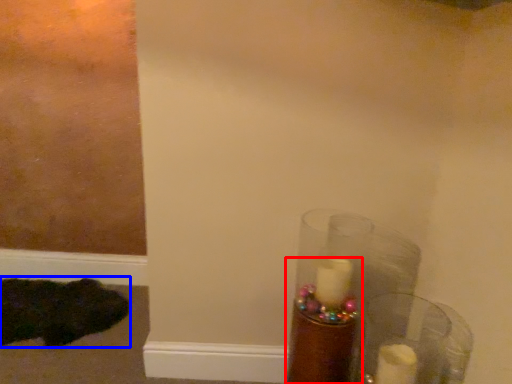
Question: Which object is closer to the camera taking this photo, candle holder (highlighted by a red box) or animal (highlighted by a blue box)?

Choices:
 (A) candle holder
 (B) animal

Answer: (A)